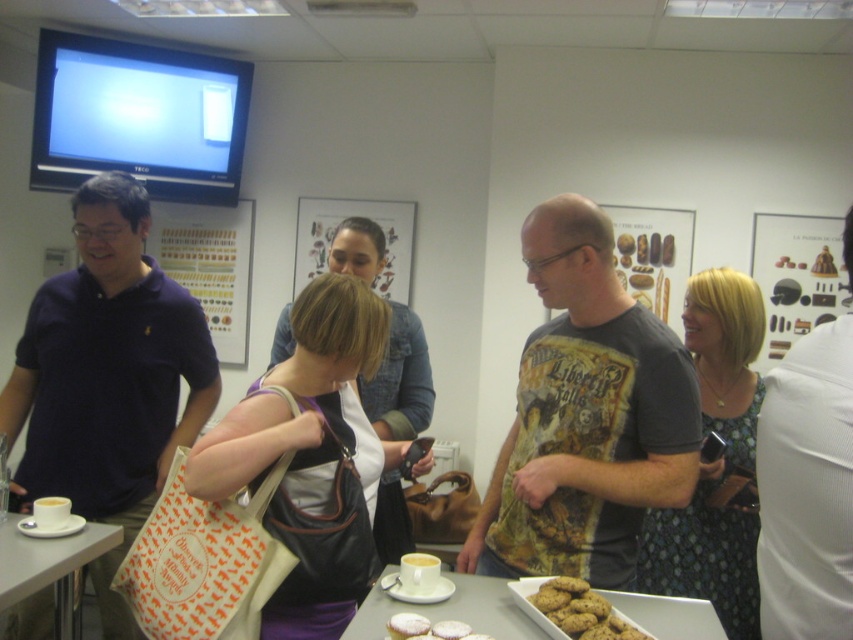
Who is positioned more to the left, white fabric shirt at right or white glossy table at lower center?

From the viewer's perspective, white glossy table at lower center appears more on the left side.

Which is below, white fabric shirt at right or white glossy table at lower center?

white glossy table at lower center is below.

Is point (786, 554) less distant than point (700, 600)?

Yes, point (786, 554) is closer to viewer.

Where is `white fabric shirt at right`? The height and width of the screenshot is (640, 853). white fabric shirt at right is located at coordinates (807, 488).

Is point (809, 620) less distant than point (566, 628)?

Yes, point (809, 620) is in front of point (566, 628).

Is white fabric shirt at right positioned before brown crumbly cookie at center?

Yes, it is in front of brown crumbly cookie at center.

Is point (793, 522) closer to viewer compared to point (598, 636)?

That is True.

Image resolution: width=853 pixels, height=640 pixels. I want to click on white fabric shirt at right, so click(807, 488).

Is dark blue polo shirt at left above white fabric shirt at right?

Actually, dark blue polo shirt at left is below white fabric shirt at right.

Does dark blue polo shirt at left have a lesser width compared to white fabric shirt at right?

No.

Who is more forward, [119,426] or [848,244]?

Result: Point [848,244] is more forward.

Identify the location of dark blue polo shirt at left. (107, 378).